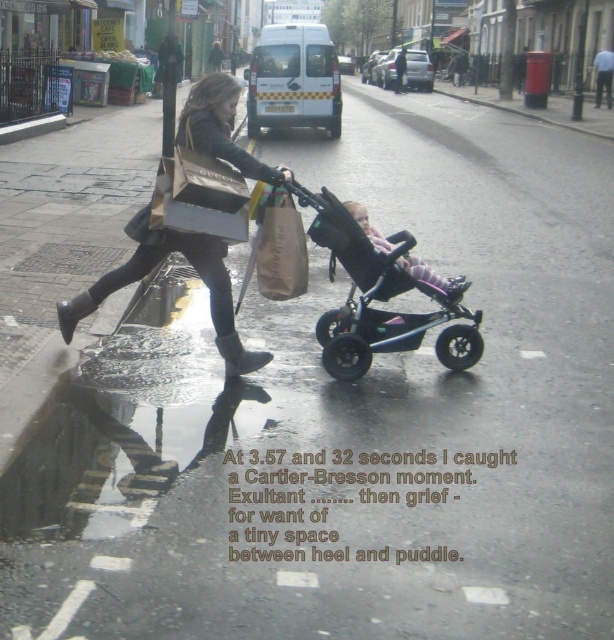
Is point (281, 282) closer to viewer compared to point (84, 304)?

Yes, it is.

In order to click on brown paper bag at center in this screenshot , I will do `click(278, 244)`.

Which is below, black plastic baby carriage at center or black rubber rain boot at lower left?

black rubber rain boot at lower left is below.

Between point (405, 278) and point (56, 308), which one is positioned behind?

The point (56, 308) is more distant.

Measure the distance between point (371,266) and camera.

Point (371,266) and camera are 5.37 meters apart from each other.

At what (x,y) coordinates should I click in order to perform the action: click on black plastic baby carriage at center. Please return your answer as a coordinate pair (x, y). Image resolution: width=614 pixels, height=640 pixels. Looking at the image, I should click on (379, 298).

What do you see at coordinates (165, 257) in the screenshot? I see `matte brown paper bag at center` at bounding box center [165, 257].

Does matte brown paper bag at center appear under black rubber rain boot at lower left?

Actually, matte brown paper bag at center is above black rubber rain boot at lower left.

Is point (111, 284) closer to camera compared to point (71, 307)?

Yes, point (111, 284) is in front of point (71, 307).

This screenshot has width=614, height=640. In order to click on matte brown paper bag at center in this screenshot , I will do `click(165, 257)`.